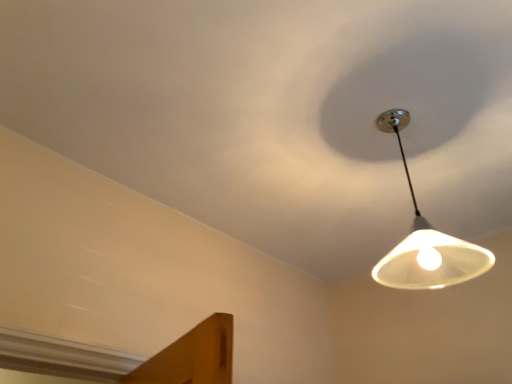
Question: From a real-world perspective, is white matte light fixture at upper right positioned under white matte lampshade at upper right based on gravity?

Choices:
 (A) no
 (B) yes

Answer: (A)

Question: Would you say white matte lampshade at upper right is part of white matte light fixture at upper right's contents?

Choices:
 (A) no
 (B) yes

Answer: (A)

Question: Is white matte light fixture at upper right closer to camera compared to white matte lampshade at upper right?

Choices:
 (A) yes
 (B) no

Answer: (A)

Question: Is white matte light fixture at upper right facing towards white matte lampshade at upper right?

Choices:
 (A) no
 (B) yes

Answer: (A)

Question: Does white matte light fixture at upper right come behind white matte lampshade at upper right?

Choices:
 (A) no
 (B) yes

Answer: (A)

Question: Does white matte light fixture at upper right have a greater width compared to white matte lampshade at upper right?

Choices:
 (A) yes
 (B) no

Answer: (A)

Question: Is white matte lampshade at upper right to the right of white matte light fixture at upper right from the viewer's perspective?

Choices:
 (A) yes
 (B) no

Answer: (A)

Question: Does white matte lampshade at upper right have a lesser width compared to white matte light fixture at upper right?

Choices:
 (A) no
 (B) yes

Answer: (B)

Question: Can you confirm if white matte lampshade at upper right is smaller than white matte light fixture at upper right?

Choices:
 (A) no
 (B) yes

Answer: (B)

Question: Can you confirm if white matte lampshade at upper right is shorter than white matte light fixture at upper right?

Choices:
 (A) no
 (B) yes

Answer: (A)

Question: Is white matte lampshade at upper right wider than white matte light fixture at upper right?

Choices:
 (A) no
 (B) yes

Answer: (A)

Question: Is white matte lampshade at upper right behind white matte light fixture at upper right?

Choices:
 (A) yes
 (B) no

Answer: (A)

Question: Is white matte lampshade at upper right bigger or smaller than white matte light fixture at upper right?

Choices:
 (A) big
 (B) small

Answer: (B)